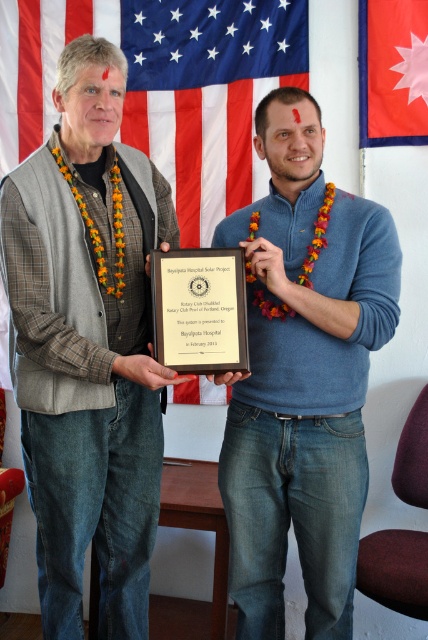
Question: Which object is the farthest from the american flag at upper center?

Choices:
 (A) nepali flag at upper right
 (B) matte black plaque at center

Answer: (B)

Question: Based on their relative distances, which object is nearer to the matte black plaque at center?

Choices:
 (A) matte gray vest at center
 (B) american flag at upper center
 (C) nepali flag at upper right

Answer: (A)

Question: Is matte black plaque at center wider than nepali flag at upper right?

Choices:
 (A) no
 (B) yes

Answer: (B)

Question: Is matte gray vest at center to the right of blue matte sweater at center from the viewer's perspective?

Choices:
 (A) yes
 (B) no

Answer: (B)

Question: Which of the following is the farthest from the observer?

Choices:
 (A) american flag at upper center
 (B) blue matte sweater at center
 (C) nepali flag at upper right
 (D) matte gray vest at center

Answer: (A)

Question: Is the position of american flag at upper center less distant than that of matte black plaque at center?

Choices:
 (A) yes
 (B) no

Answer: (B)